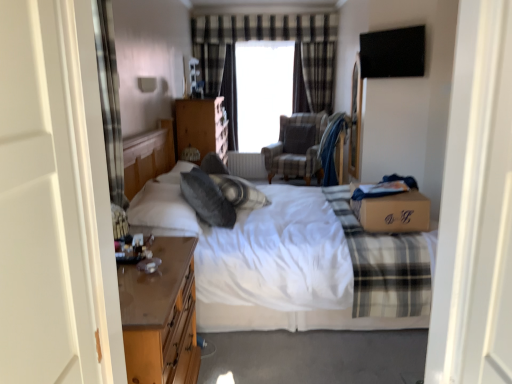
Question: Are white cotton bed at center and white plastic radiator at center located far from each other?

Choices:
 (A) no
 (B) yes

Answer: (B)

Question: Does white cotton bed at center have a greater height compared to white plastic radiator at center?

Choices:
 (A) no
 (B) yes

Answer: (B)

Question: Does white cotton bed at center have a greater width compared to white plastic radiator at center?

Choices:
 (A) no
 (B) yes

Answer: (B)

Question: Is white cotton bed at center further to camera compared to white plastic radiator at center?

Choices:
 (A) no
 (B) yes

Answer: (A)

Question: From a real-world perspective, is white cotton bed at center under white plastic radiator at center?

Choices:
 (A) yes
 (B) no

Answer: (B)

Question: From the image's perspective, is plaid fabric at right located above or below wooden chest of drawers at center?

Choices:
 (A) above
 (B) below

Answer: (B)

Question: Is point (357, 236) positioned closer to the camera than point (197, 110)?

Choices:
 (A) closer
 (B) farther

Answer: (A)

Question: Considering the positions of plaid fabric at right and wooden chest of drawers at center in the image, is plaid fabric at right wider or thinner than wooden chest of drawers at center?

Choices:
 (A) wide
 (B) thin

Answer: (A)

Question: Choose the correct answer: Is plaid fabric at right inside wooden chest of drawers at center or outside it?

Choices:
 (A) inside
 (B) outside

Answer: (B)

Question: Is point (202, 193) positioned closer to the camera than point (280, 170)?

Choices:
 (A) closer
 (B) farther

Answer: (A)

Question: In terms of height, does gray soft pillow at center, the first pillow in the bottom-to-top sequence, look taller or shorter compared to plaid fabric armchair at center?

Choices:
 (A) short
 (B) tall

Answer: (A)

Question: Considering the positions of gray soft pillow at center, the first pillow from the left, and plaid fabric armchair at center in the image, is gray soft pillow at center, the first pillow from the left, bigger or smaller than plaid fabric armchair at center?

Choices:
 (A) big
 (B) small

Answer: (B)

Question: Visually, is gray soft pillow at center, the first pillow viewed from the front, positioned to the left or to the right of plaid fabric armchair at center?

Choices:
 (A) left
 (B) right

Answer: (A)

Question: From the image's perspective, is plaid fabric at right above or below transparent glass window at center?

Choices:
 (A) above
 (B) below

Answer: (B)

Question: Is plaid fabric at right inside the boundaries of transparent glass window at center, or outside?

Choices:
 (A) inside
 (B) outside

Answer: (B)